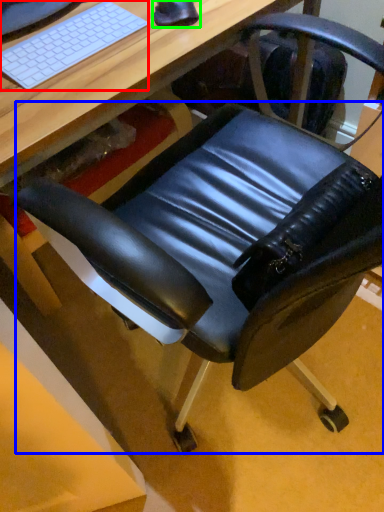
Question: Considering the real-world distances, which object is closest to computer keyboard (highlighted by a red box)? swivel chair (highlighted by a blue box) or mouse (highlighted by a green box).

Choices:
 (A) swivel chair
 (B) mouse

Answer: (B)